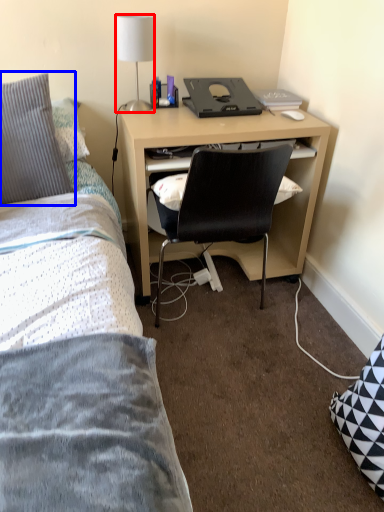
Question: Which point is closer to the camera, lamp (highlighted by a red box) or pillow (highlighted by a blue box)?

Choices:
 (A) lamp
 (B) pillow

Answer: (B)